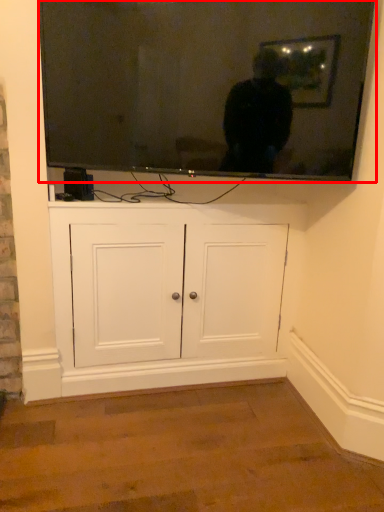
Question: From the image's perspective, where is television (annotated by the red box) located in relation to cabinetry in the image?

Choices:
 (A) below
 (B) above

Answer: (B)